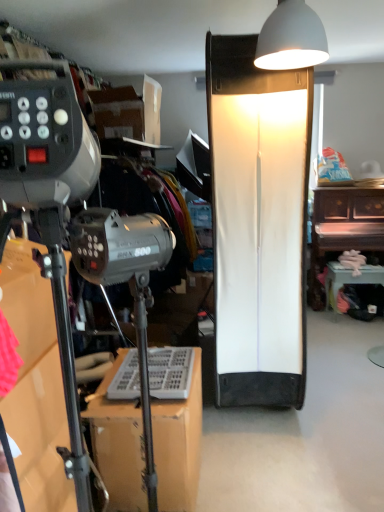
Question: Should I look upward or downward to see wooden piano at right, the first furniture in the right-to-left sequence?

Choices:
 (A) down
 (B) up

Answer: (B)

Question: Does white matte lampshade at upper center, the second lamp when ordered from back to front, have a smaller size compared to white matte lampshade at center, which is counted as the second lamp, starting from the front?

Choices:
 (A) yes
 (B) no

Answer: (A)

Question: From the image's perspective, is white matte lampshade at upper center, placed as the first lamp when sorted from front to back, below white matte lampshade at center, positioned as the 1th lamp in bottom-to-top order?

Choices:
 (A) yes
 (B) no

Answer: (B)

Question: Can you confirm if white matte lampshade at upper center, the second lamp in the bottom-to-top sequence, is wider than white matte lampshade at center, which is counted as the first lamp, starting from the back?

Choices:
 (A) yes
 (B) no

Answer: (B)

Question: Is white matte lampshade at upper center, acting as the 1th lamp starting from the top, closer to camera compared to white matte lampshade at center, which is counted as the second lamp, starting from the front?

Choices:
 (A) yes
 (B) no

Answer: (A)

Question: Would you say white matte lampshade at center, which is the second lamp from top to bottom, is part of white matte lampshade at upper center, acting as the 1th lamp starting from the top,'s contents?

Choices:
 (A) no
 (B) yes

Answer: (A)

Question: From a real-world perspective, is white matte lampshade at upper center, the second lamp when ordered from back to front, over white matte lampshade at center, which is counted as the first lamp, starting from the back?

Choices:
 (A) no
 (B) yes

Answer: (B)

Question: From the image's perspective, would you say metallic silver tripod at lower left, marked as the first furniture in a front-to-back arrangement, is positioned over wooden piano at right, the first furniture in the back-to-front sequence?

Choices:
 (A) no
 (B) yes

Answer: (A)

Question: Can you confirm if metallic silver tripod at lower left, which is the 3th furniture from back to front, is smaller than wooden piano at right, the first furniture in the back-to-front sequence?

Choices:
 (A) yes
 (B) no

Answer: (A)

Question: From the image's perspective, is metallic silver tripod at lower left, marked as the third furniture in a right-to-left arrangement, beneath wooden piano at right, which ranks as the 3th furniture in front-to-back order?

Choices:
 (A) yes
 (B) no

Answer: (A)

Question: Does metallic silver tripod at lower left, which is the 3th furniture from back to front, have a greater width compared to wooden piano at right, placed as the third furniture when sorted from left to right?

Choices:
 (A) yes
 (B) no

Answer: (B)

Question: Is metallic silver tripod at lower left, the 1th furniture in the left-to-right sequence, positioned in front of wooden piano at right, the first furniture in the right-to-left sequence?

Choices:
 (A) no
 (B) yes

Answer: (B)

Question: Is the surface of white matte lampshade at upper center, the second lamp in the bottom-to-top sequence, in direct contact with metallic silver tripod at lower left, which is the 3th furniture from back to front?

Choices:
 (A) yes
 (B) no

Answer: (B)